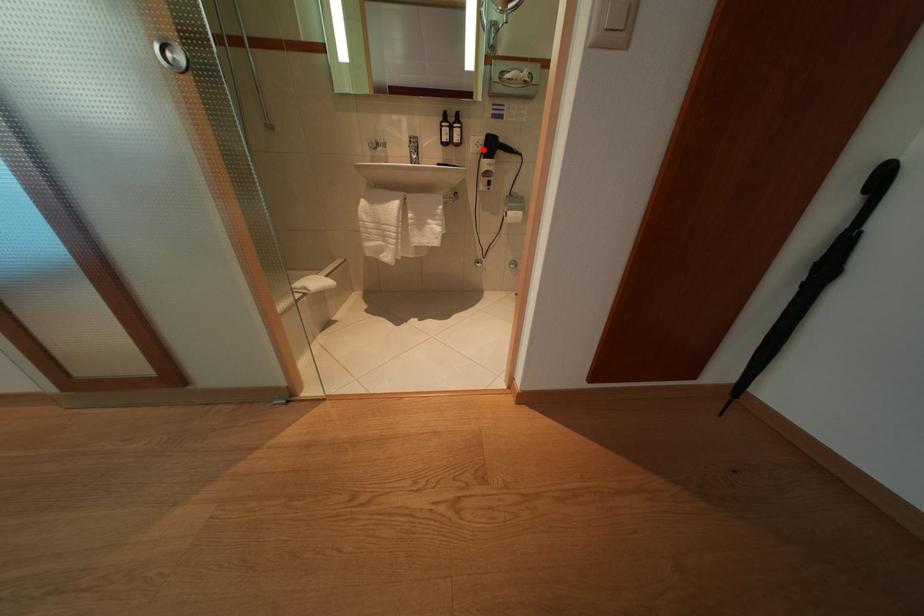
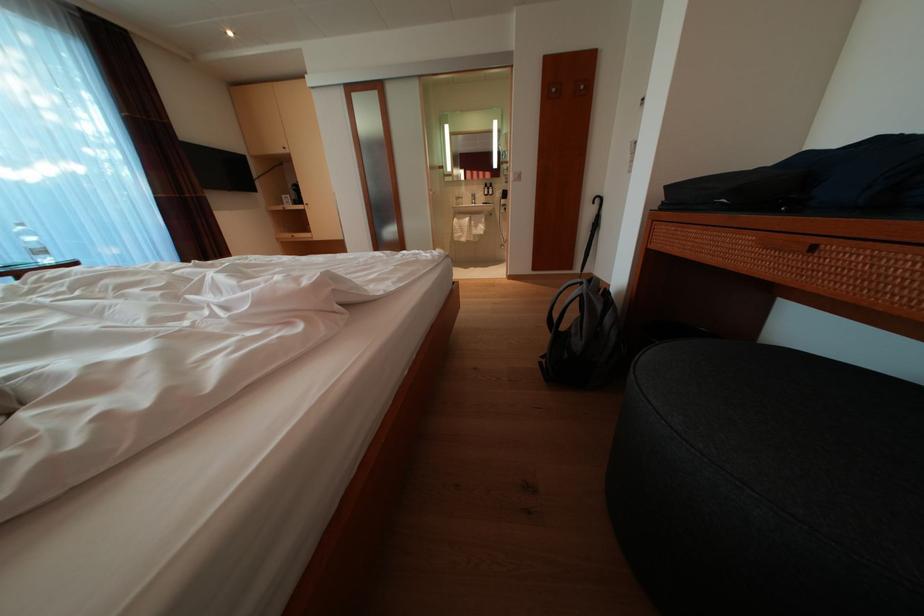
In the second image, find the point that corresponds to the highlighted location in the first image.

(506, 200)